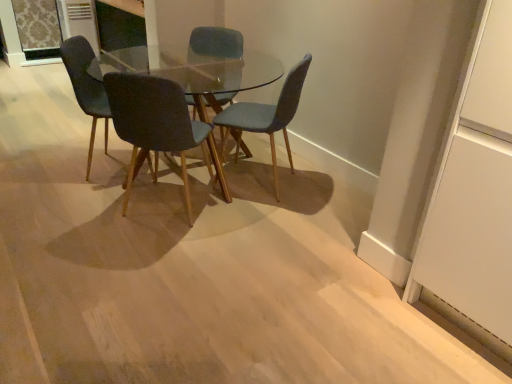
Locate an element on the screen. The height and width of the screenshot is (384, 512). free space to the left of dark gray fabric chair at center, which appears as the third chair when viewed from the right is located at coordinates (86, 208).